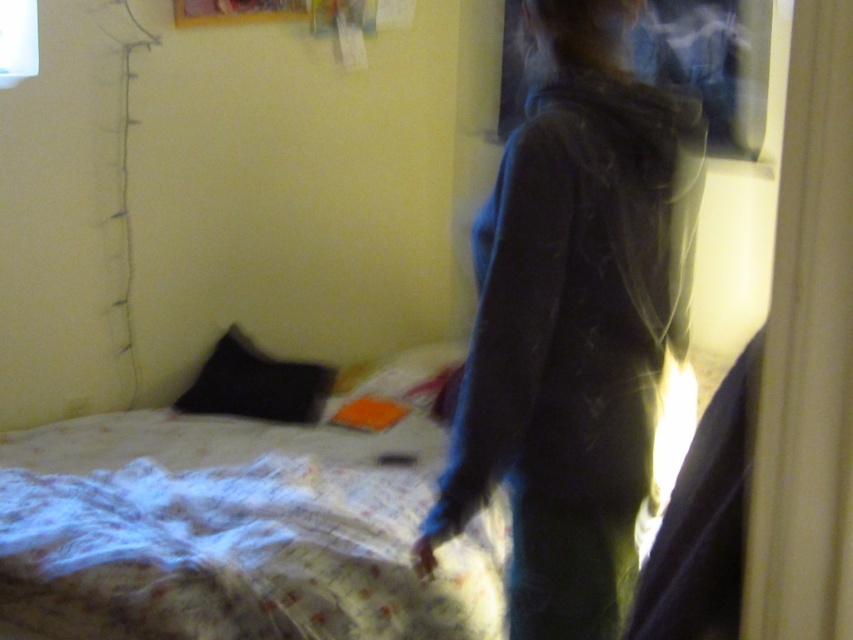
The width and height of the screenshot is (853, 640). In order to click on dark blue hoodie at center in this screenshot , I will do `click(573, 326)`.

What do you see at coordinates (573, 326) in the screenshot? Image resolution: width=853 pixels, height=640 pixels. I see `dark blue hoodie at center` at bounding box center [573, 326].

Who is more distant from viewer, (686, 134) or (688, 372)?

The point (688, 372) is behind.

Where is `dark blue hoodie at center`? The height and width of the screenshot is (640, 853). dark blue hoodie at center is located at coordinates (573, 326).